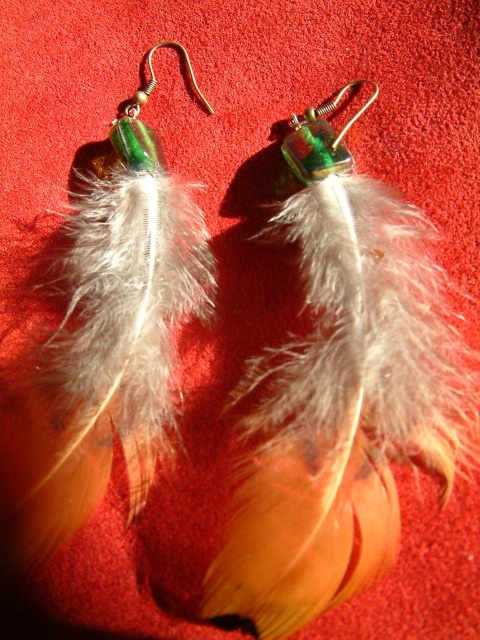
Question: Does feather earrings at center have a smaller size compared to green glass hook at center?

Choices:
 (A) no
 (B) yes

Answer: (A)

Question: Can you confirm if feather earrings at center is positioned above green glass hook at center?

Choices:
 (A) yes
 (B) no

Answer: (B)

Question: Does feather earrings at center appear over green glass hook at center?

Choices:
 (A) no
 (B) yes

Answer: (A)

Question: Which point is farther from the camera taking this photo?

Choices:
 (A) (21, 449)
 (B) (365, 104)

Answer: (B)

Question: Which of the following is the farthest from the observer?

Choices:
 (A) (314, 138)
 (B) (147, 164)

Answer: (B)